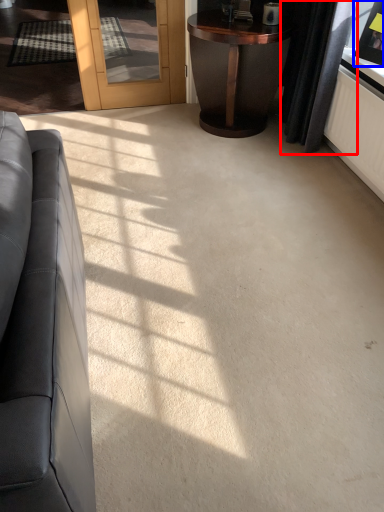
Question: Which of the following is the closest to the observer, curtain (highlighted by a red box) or picture frame (highlighted by a blue box)?

Choices:
 (A) curtain
 (B) picture frame

Answer: (B)